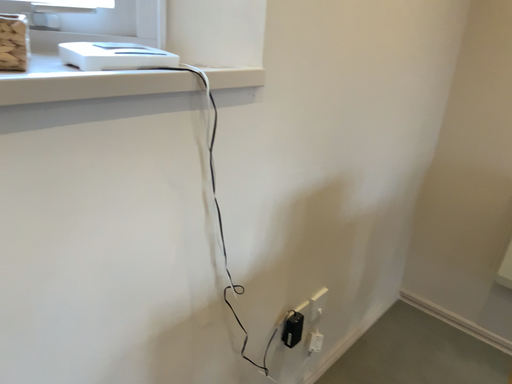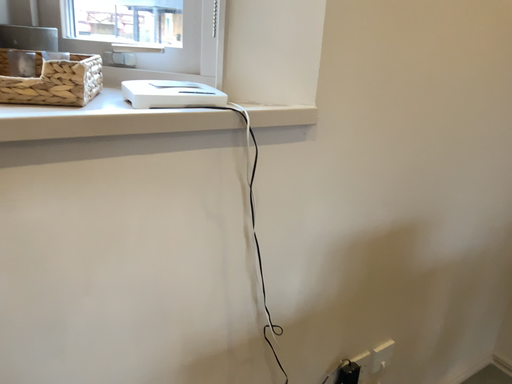
Question: How did the camera likely rotate when shooting the video?

Choices:
 (A) rotated right
 (B) rotated left

Answer: (B)